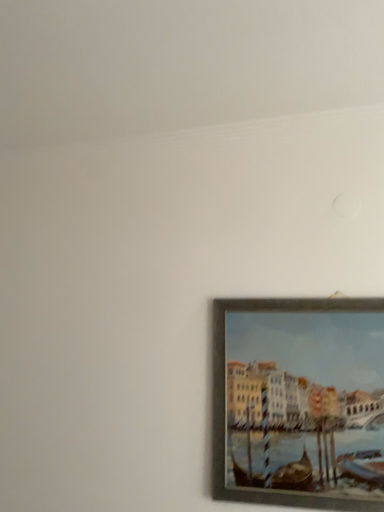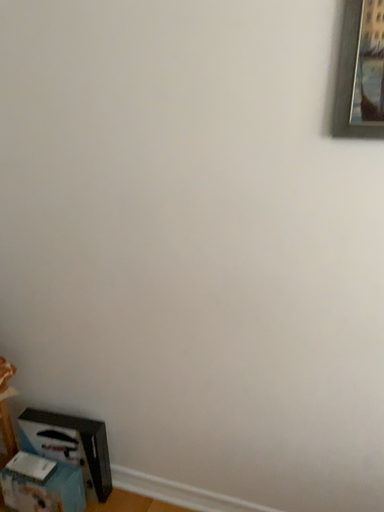
Question: How did the camera likely rotate when shooting the video?

Choices:
 (A) rotated left
 (B) rotated right

Answer: (A)